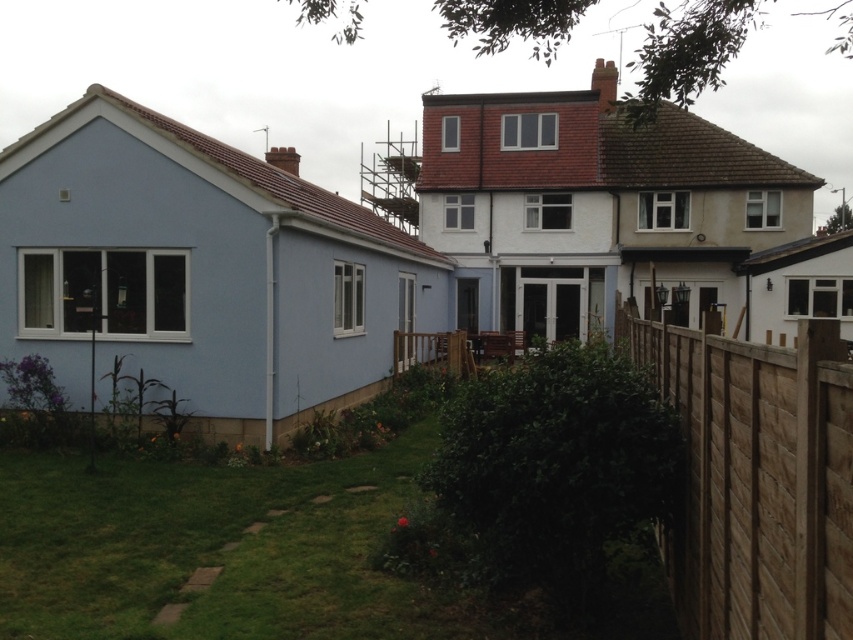
Question: Does green grass at lower left have a greater width compared to brown wooden fence at right?

Choices:
 (A) yes
 (B) no

Answer: (A)

Question: Is the position of green grass at lower left less distant than that of brown wooden fence at right?

Choices:
 (A) no
 (B) yes

Answer: (A)

Question: Can you confirm if green grass at lower left is positioned to the left of brown wooden fence at right?

Choices:
 (A) yes
 (B) no

Answer: (A)